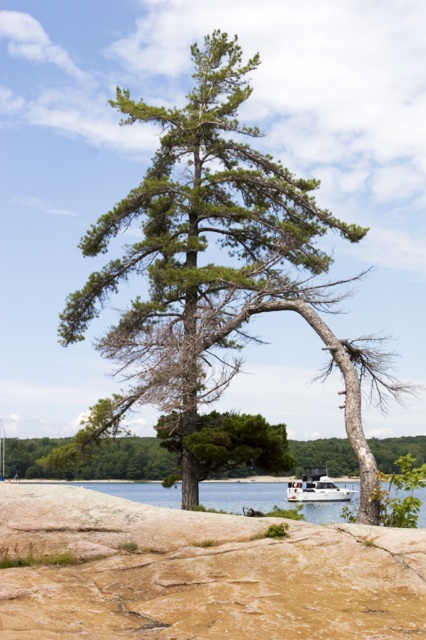
Question: Which of the following is the farthest from the observer?

Choices:
 (A) (42, 449)
 (B) (65, 456)
 (C) (331, 486)
 (D) (88, 484)

Answer: (D)

Question: Does green needle-like foliage at center appear on the left side of clear blue water at lower center?

Choices:
 (A) yes
 (B) no

Answer: (A)

Question: Which of the following is the closest to the observer?

Choices:
 (A) (114, 483)
 (B) (183, 125)
 (C) (345, 456)

Answer: (B)

Question: Does green needle-like foliage at center appear on the left side of clear blue water at lower center?

Choices:
 (A) no
 (B) yes

Answer: (B)

Question: Which point is closer to the camera taking this photo?

Choices:
 (A) (321, 483)
 (B) (218, 499)
 (C) (301, 440)

Answer: (A)

Question: Does green needle-like foliage at center appear under white matte boat at lower center?

Choices:
 (A) yes
 (B) no

Answer: (B)